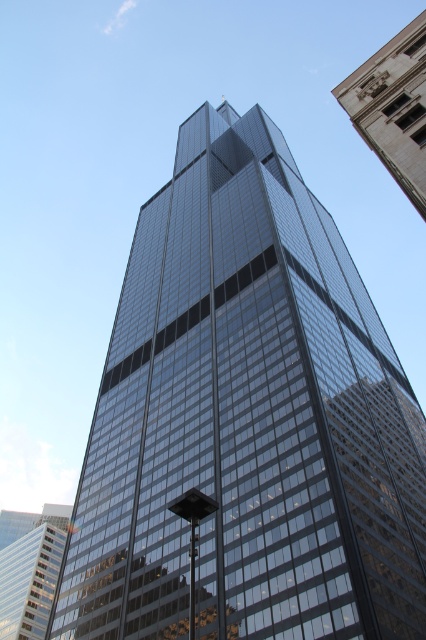
Who is shorter, white stone building at upper right or glassy reflective skyscraper at center?

Standing shorter between the two is glassy reflective skyscraper at center.

Identify the location of white stone building at upper right. This screenshot has width=426, height=640. (394, 108).

Is point (403, 164) farther from viewer compared to point (26, 600)?

That is False.

Find the location of a particular element. white stone building at upper right is located at coordinates (394, 108).